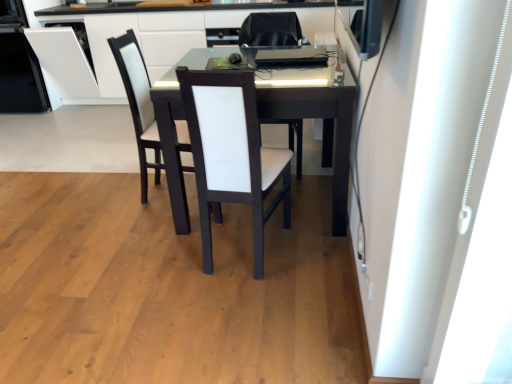
The image size is (512, 384). I want to click on free space that is to the left of white leather chair at center, acting as the second chair starting from the back, so click(152, 257).